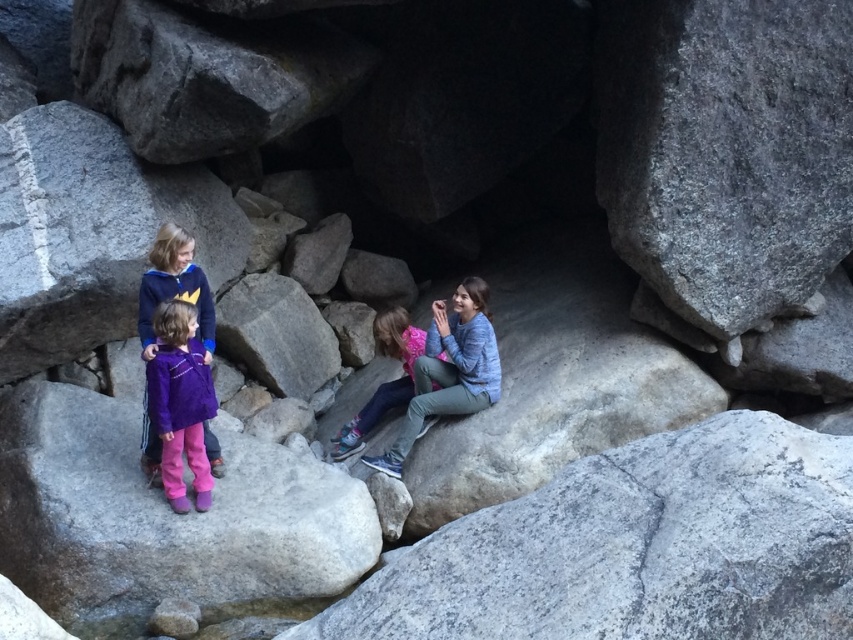
Question: Which object is closer to the camera taking this photo?

Choices:
 (A) gray rough rock at center
 (B) pink fleece jacket at center
 (C) blue denim jeans at center
 (D) purple fleece jacket at lower left

Answer: (A)

Question: Is blue denim jeans at center above pink fleece jacket at center?

Choices:
 (A) no
 (B) yes

Answer: (B)

Question: From the image, what is the correct spatial relationship of purple fabric pants at lower left in relation to purple fleece jacket at lower left?

Choices:
 (A) left
 (B) right

Answer: (A)

Question: Which object appears closest to the camera in this image?

Choices:
 (A) purple fleece jacket at lower left
 (B) gray rough rock at center
 (C) purple fabric pants at lower left
 (D) blue denim jeans at center

Answer: (B)

Question: Which of the following is the farthest from the observer?

Choices:
 (A) pyautogui.click(x=610, y=524)
 (B) pyautogui.click(x=222, y=506)
 (C) pyautogui.click(x=384, y=308)

Answer: (C)

Question: Can you confirm if purple fabric pants at lower left is positioned below pink fleece jacket at center?

Choices:
 (A) yes
 (B) no

Answer: (A)